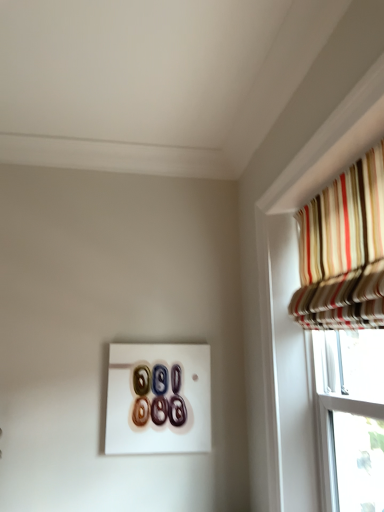
Question: Visually, is striped fabric curtain at upper right positioned to the left or to the right of glossy ceramic buttons at center?

Choices:
 (A) right
 (B) left

Answer: (A)

Question: From a real-world perspective, is striped fabric curtain at upper right above or below glossy ceramic buttons at center?

Choices:
 (A) above
 (B) below

Answer: (A)

Question: In the image, is striped fabric curtain at upper right positioned in front of or behind glossy ceramic buttons at center?

Choices:
 (A) front
 (B) behind

Answer: (A)

Question: From a real-world perspective, is glossy ceramic buttons at center physically located above or below striped fabric curtain at upper right?

Choices:
 (A) above
 (B) below

Answer: (B)

Question: Is glossy ceramic buttons at center in front of or behind striped fabric curtain at upper right in the image?

Choices:
 (A) behind
 (B) front

Answer: (A)

Question: Is point (148, 395) positioned closer to the camera than point (339, 265)?

Choices:
 (A) closer
 (B) farther

Answer: (B)

Question: Considering the positions of glossy ceramic buttons at center and striped fabric curtain at upper right in the image, is glossy ceramic buttons at center taller or shorter than striped fabric curtain at upper right?

Choices:
 (A) tall
 (B) short

Answer: (B)